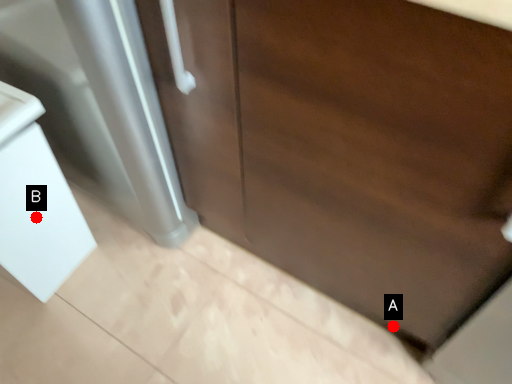
Question: Two points are circled on the image, labeled by A and B beside each circle. Among these points, which one is farthest from the camera?

Choices:
 (A) A is further
 (B) B is further

Answer: (A)